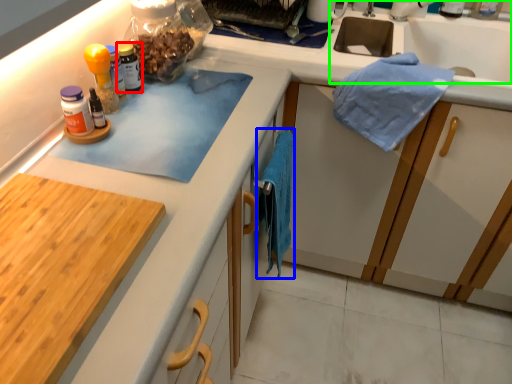
Question: Which is farther away from bottle (highlighted by a red box)? bath towel (highlighted by a blue box) or sink (highlighted by a green box)?

Choices:
 (A) bath towel
 (B) sink

Answer: (B)